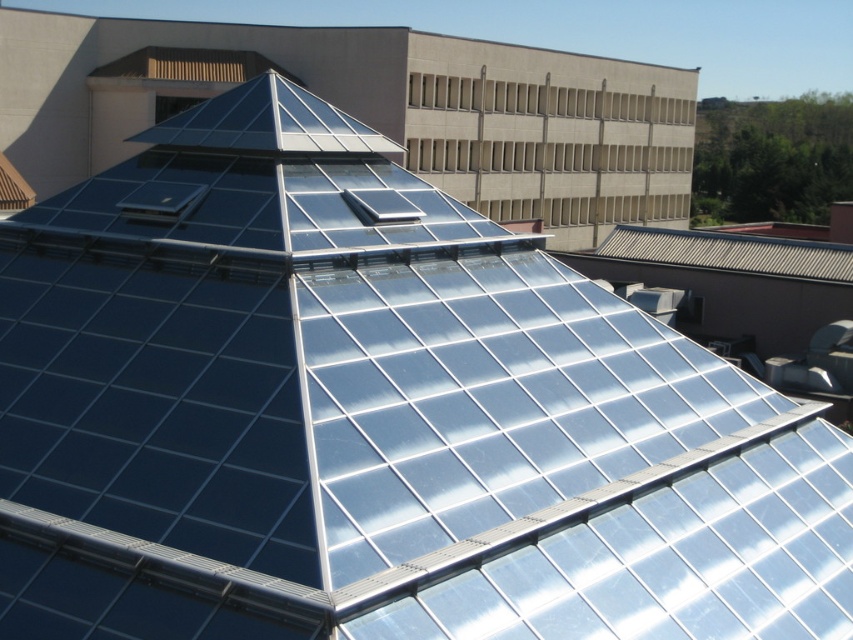
You are an architect evaluating the placement of solar batteries on the glass pyramid roof. You have two options available for installation. The first is the black glossy solar battery at upper left, and the second is the transparent glass solar battery at center. Based on their sizes, which one would you choose if you want to cover more area with a single battery?

The black glossy solar battery at upper left has a larger size compared to the transparent glass solar battery at center, so it would cover more area with a single battery.

You are an engineer assessing the solar batteries on the glass pyramid roof. Which solar battery, the black glossy solar battery at upper left or the transparent glass solar battery at center, is taller?

The black glossy solar battery at upper left has a greater height compared to the transparent glass solar battery at center, so the black glossy solar battery at upper left is taller.

You are an architect designing a solar panel installation. You need to place a new rectangular solar panel between the black glossy solar battery at upper left and the transparent glass solar battery at center. Based on their widths, which battery should the new panel be placed next to to ensure it fits properly?

The black glossy solar battery at upper left might be wider than transparent glass solar battery at center, so the new rectangular solar panel should be placed next to the black glossy solar battery at upper left to ensure it fits properly.